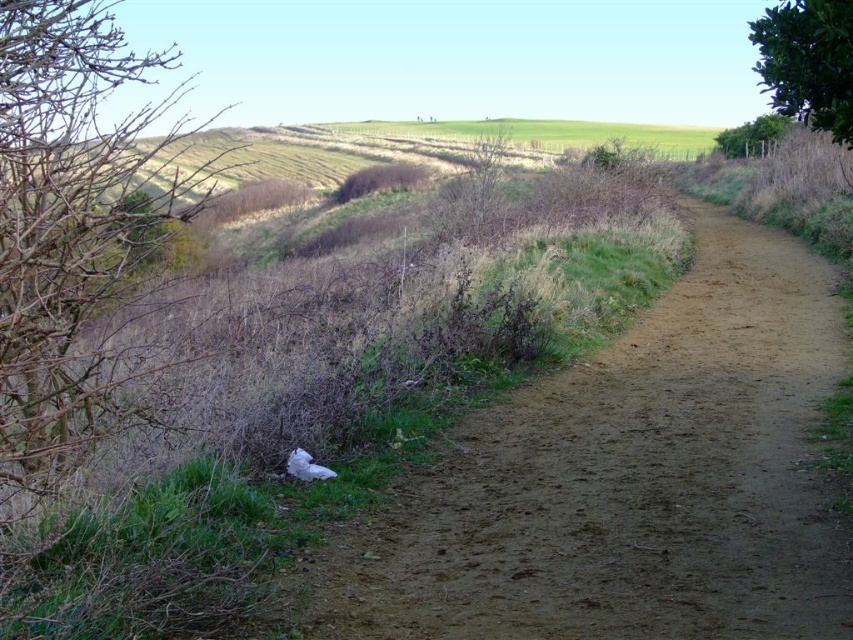
Question: Which object is positioned closest to the green leafy hedge at upper right?

Choices:
 (A) brown dry branches at left
 (B) brown dirt track at center
 (C) brown dry hedge at center

Answer: (C)

Question: Where is brown dirt track at center located in relation to brown dry branches at left in the image?

Choices:
 (A) left
 (B) right

Answer: (B)

Question: Does brown dry branches at left appear on the left side of brown dry hedge at center?

Choices:
 (A) no
 (B) yes

Answer: (B)

Question: Does brown dry branches at left appear under green leafy hedge at upper right?

Choices:
 (A) yes
 (B) no

Answer: (A)

Question: Which of the following is the farthest from the observer?

Choices:
 (A) (65, 428)
 (B) (763, 134)
 (C) (693, 586)

Answer: (B)

Question: Estimate the real-world distances between objects in this image. Which object is closer to the brown dry hedge at center?

Choices:
 (A) green leafy hedge at upper right
 (B) brown dry branches at left
 (C) brown dirt track at center

Answer: (B)